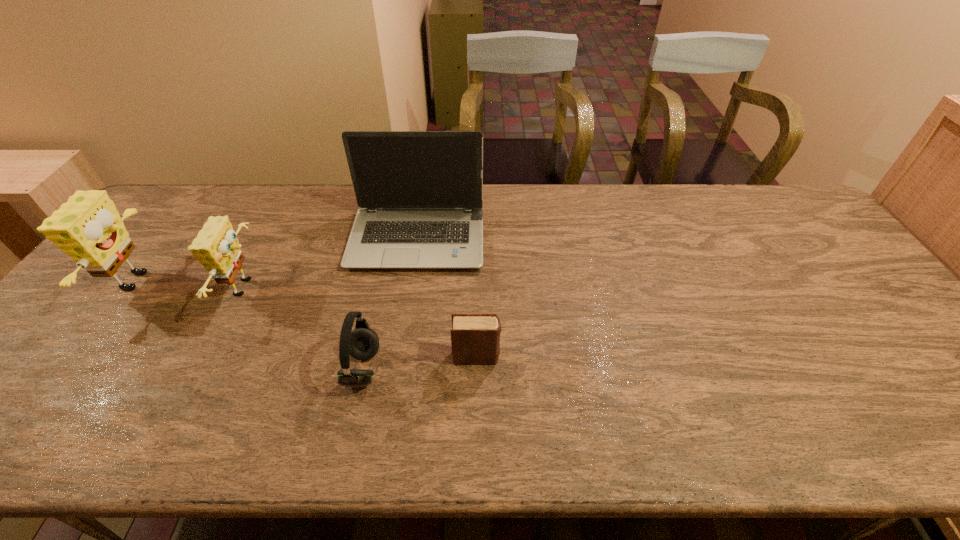
Locate an element on the screen. The width and height of the screenshot is (960, 540). free space that satisfies the following two spatial constraints: 1. on the screen of the laptop computer; 2. on the face of the right sponge is located at coordinates (410, 287).

I want to click on vacant space that satisfies the following two spatial constraints: 1. on the screen of the laptop computer; 2. on the ear cups of the fourth tallest object, so click(x=398, y=369).